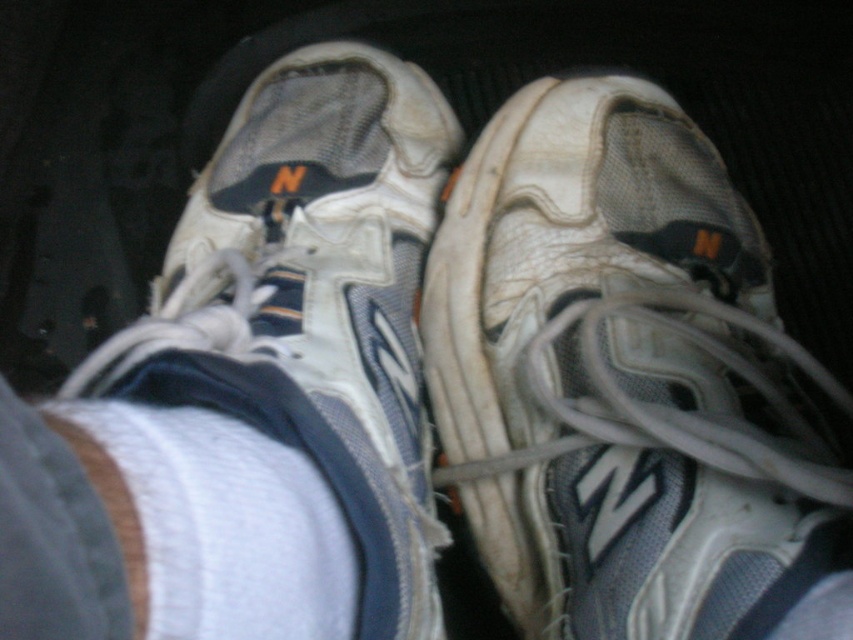
Does white mesh running shoe at center have a greater height compared to white fabric at lower center?

Yes, white mesh running shoe at center is taller than white fabric at lower center.

Which is in front, point (521, 218) or point (109, 474)?

Point (109, 474) is more forward.

Identify the location of white mesh running shoe at center. (622, 380).

Locate an element on the screen. This screenshot has width=853, height=640. white mesh running shoe at center is located at coordinates (622, 380).

Is white fabric sock at lower center smaller than white fabric at lower center?

No.

Locate an element on the screen. This screenshot has width=853, height=640. white fabric sock at lower center is located at coordinates (213, 524).

Does white mesh shoe at center come in front of white fabric at lower center?

No, it is behind white fabric at lower center.

Does white mesh shoe at center appear on the left side of white fabric at lower center?

No, white mesh shoe at center is not to the left of white fabric at lower center.

Describe the element at coordinates (314, 304) in the screenshot. This screenshot has height=640, width=853. I see `white mesh shoe at center` at that location.

This screenshot has width=853, height=640. I want to click on white mesh shoe at center, so click(314, 304).